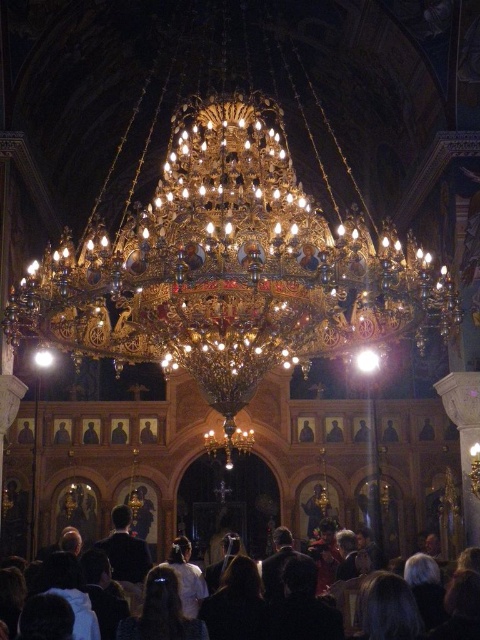
Question: Can you confirm if wooden framed portrait at center is wider than wooden icon at center?

Choices:
 (A) no
 (B) yes

Answer: (B)

Question: Can you confirm if wooden framed portrait at center is wider than smooth black portrait at center?

Choices:
 (A) yes
 (B) no

Answer: (A)

Question: Which of the following is the closest to the observer?

Choices:
 (A) smooth black portrait at center
 (B) dark brown wooden icon at center

Answer: (B)

Question: Which object is positioned closest to the dark brown wooden figure at center?

Choices:
 (A) wooden portrait at center
 (B) black fabric crowd at lower center
 (C) smooth black portrait at center
 (D) wooden framed portrait at center

Answer: (A)

Question: Which point is closer to the camera?

Choices:
 (A) smooth black portrait at center
 (B) dark brown wooden figure at center

Answer: (B)

Question: From the image, what is the correct spatial relationship of wooden framed portrait at center in relation to dark brown wood portrait at center?

Choices:
 (A) right
 (B) left

Answer: (A)